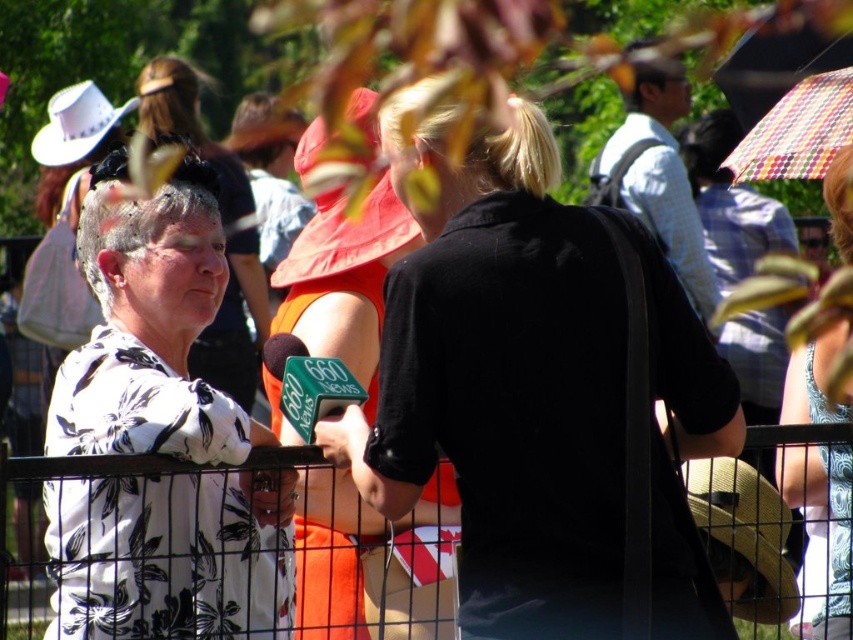
You are a photographer trying to capture a clear shot of the patterned fabric dress at center and the black metal fence at center. From your current position, which object is located to the right of the other?

The patterned fabric dress at center is positioned on the right side of black metal fence at center, so the dress is to the right of the fence.

You are a photographer standing at the center of the scene. You want to take a photo that includes both the brown straw cowboy hat at lower right and the white felt cowboy hat at upper left. Given their positions, can you capture both in a single frame without moving your position?

The distance between the brown straw cowboy hat at lower right and the white felt cowboy hat at upper left is 20.26 meters. Since the photographer is stationary at the center, capturing both in one frame would depend on the camera lens. A standard lens might struggle with this distance, but a wide angle or zoom lens could potentially include both.